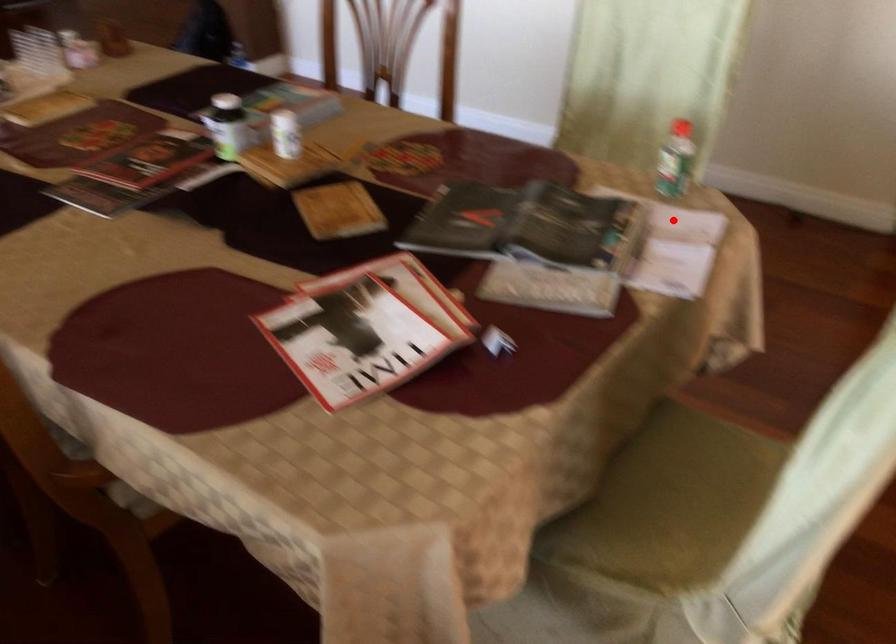
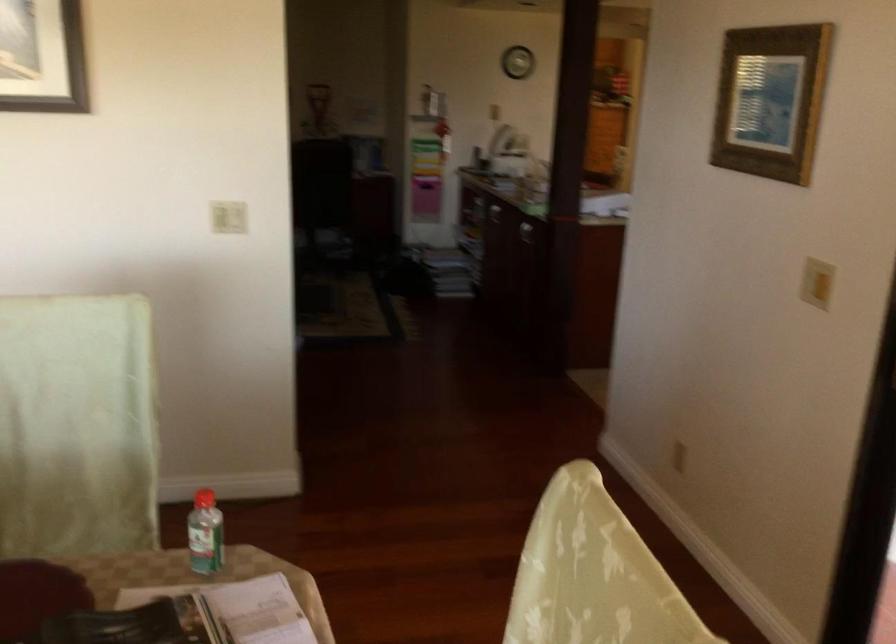
Question: A red point is marked in image1. In image2, is the corresponding 3D point closer to the camera or farther? Reply with the corresponding letter.

Choices:
 (A) The corresponding 3D point is closer.
 (B) The corresponding 3D point is farther.

Answer: (A)